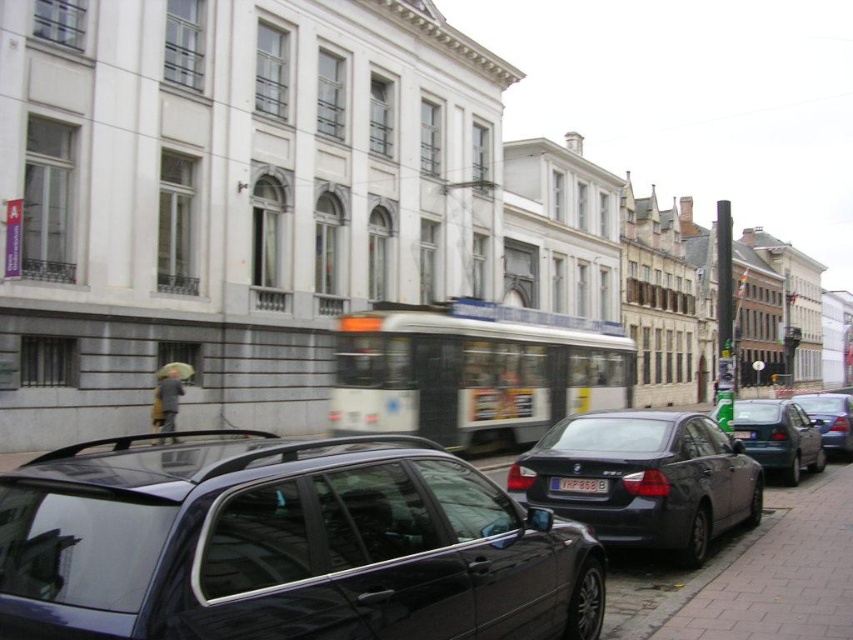
Find the location of a particular element. shiny black car at center is located at coordinates [x=285, y=545].

Who is higher up, shiny black car at center or metallic silver sedan at center?

shiny black car at center

I want to click on shiny black car at center, so click(285, 545).

Can you confirm if shiny black car at center is shorter than matte black sedan at right?

No, shiny black car at center is not shorter than matte black sedan at right.

Who is higher up, shiny black car at center or matte black sedan at right?

matte black sedan at right

At what (x,y) coordinates should I click in order to perform the action: click on shiny black car at center. Please return your answer as a coordinate pair (x, y). The width and height of the screenshot is (853, 640). Looking at the image, I should click on (285, 545).

What do you see at coordinates (645, 477) in the screenshot?
I see `matte black sedan at center` at bounding box center [645, 477].

Is matte black sedan at center below metallic silver sedan at center?

Actually, matte black sedan at center is above metallic silver sedan at center.

Where is `matte black sedan at center`? The height and width of the screenshot is (640, 853). matte black sedan at center is located at coordinates (645, 477).